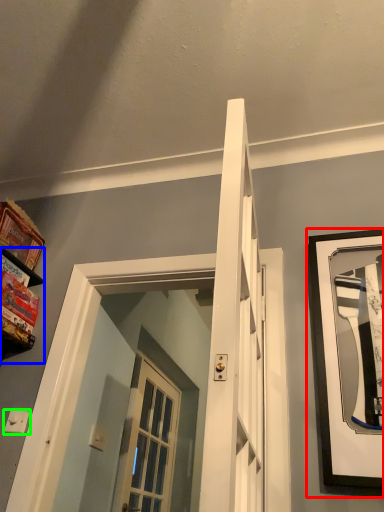
Question: Which object is the farthest from picture frame (highlighted by a red box)? Choose among these: shelf (highlighted by a blue box) or light switch (highlighted by a green box).

Choices:
 (A) shelf
 (B) light switch

Answer: (A)